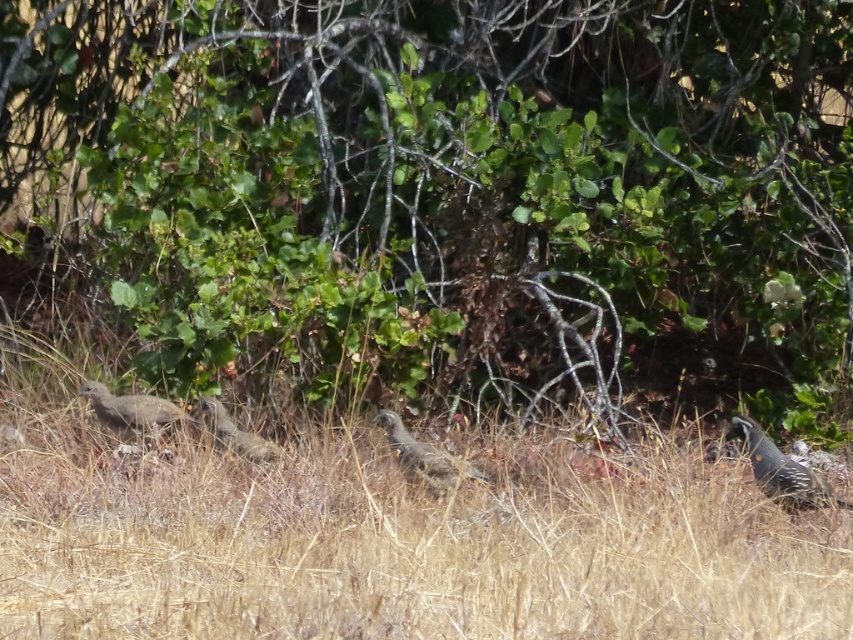
You are a hiker observing the birds in the grassy area. Which bird is positioned lower in the scene between the speckled feathered quail at right and the speckled brown bird at center?

The speckled feathered quail at right is located below the speckled brown bird at center, so it is positioned lower in the scene.

You are a photographer trying to capture a closeup of the speckled brown bird at left without disturbing it. You are currently standing behind the dry grass at center. Which direction should you move to get a better view of the bird?

The dry grass at center is wider than the speckled brown bird at left, so moving to the right or left side of the dry grass at center would provide a clearer view of the speckled brown bird at left.